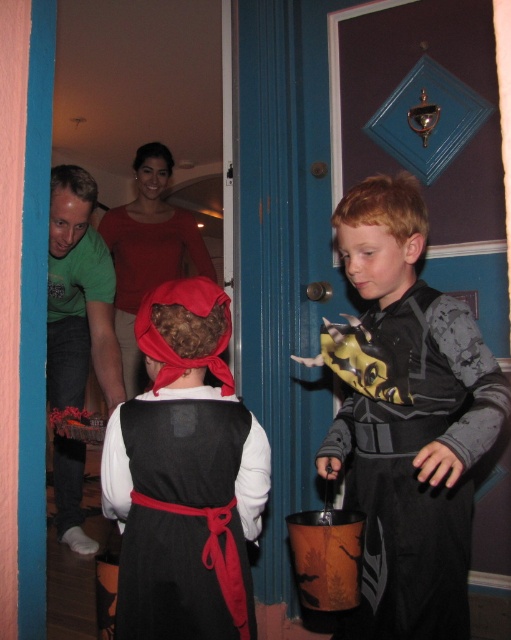
Question: Can you confirm if black matte costume at center is positioned to the right of velvet black dress at center?

Choices:
 (A) no
 (B) yes

Answer: (B)

Question: Which object is farther from the camera taking this photo?

Choices:
 (A) velvet black dress at center
 (B) black matte costume at center

Answer: (A)

Question: Does black matte costume at center appear on the right side of velvet black dress at center?

Choices:
 (A) no
 (B) yes

Answer: (B)

Question: Among these points, which one is nearest to the camera?

Choices:
 (A) (494, 416)
 (B) (195, 611)

Answer: (B)

Question: Is black matte costume at center below velvet black dress at center?

Choices:
 (A) yes
 (B) no

Answer: (B)

Question: Among these points, which one is farthest from the camera?

Choices:
 (A) (407, 289)
 (B) (223, 403)

Answer: (A)